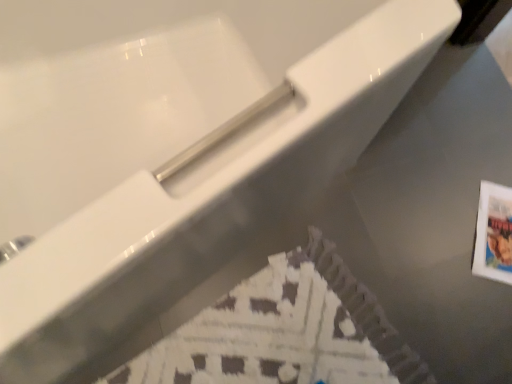
At what (x,y) coordinates should I click in order to perform the action: click on empty space that is in between white paper flyer at lower center and printed paper postcard at lower right. Please return your answer as a coordinate pair (x, y). This screenshot has height=384, width=512. Looking at the image, I should click on (422, 278).